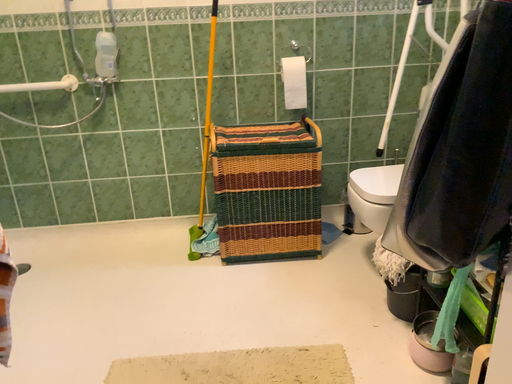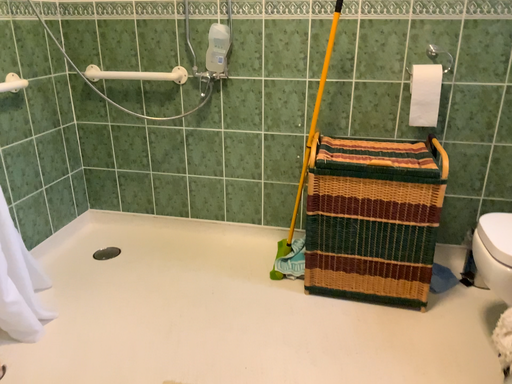
Question: How did the camera likely rotate when shooting the video?

Choices:
 (A) rotated left
 (B) rotated right

Answer: (A)